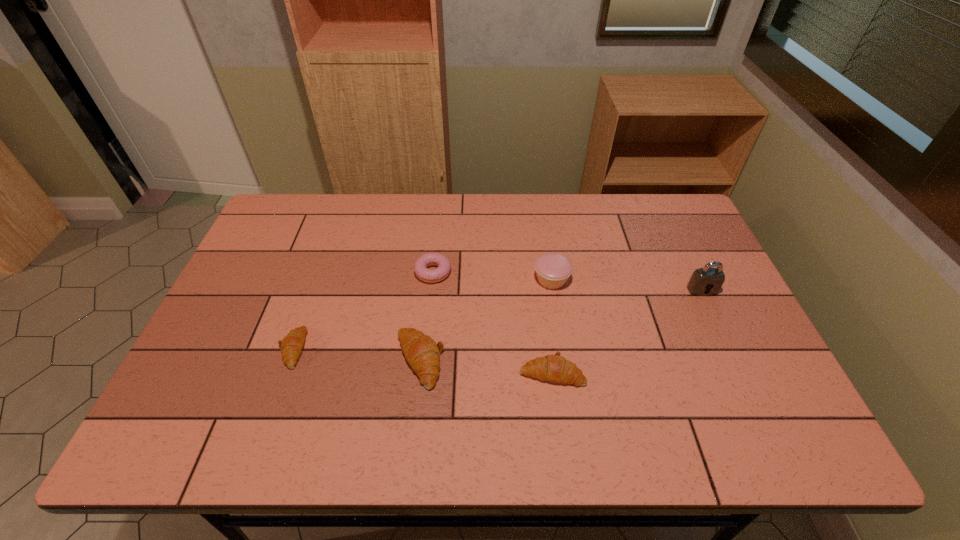
Find the location of a particular element. This screenshot has height=540, width=960. free point at the near left corner is located at coordinates (252, 376).

This screenshot has width=960, height=540. In order to click on free space at the far right corner in this screenshot , I will do `click(645, 216)`.

Locate an element on the screen. This screenshot has width=960, height=540. free space that is in between the second tallest object and the second crescent roll from left to right is located at coordinates (486, 320).

Where is `vacant region between the leftmost crescent roll and the cupcake`? The height and width of the screenshot is (540, 960). vacant region between the leftmost crescent roll and the cupcake is located at coordinates (422, 314).

Identify the location of free space that is in between the second tallest object and the shortest crescent roll. (422, 314).

Identify the location of unoccupied position between the second crescent roll from left to right and the doughnut. (426, 316).

Identify the location of free space between the doughnut and the second crescent roll from left to right. The width and height of the screenshot is (960, 540). (426, 316).

This screenshot has height=540, width=960. Find the location of `vacant area that lies between the tallest crescent roll and the leftmost crescent roll`. vacant area that lies between the tallest crescent roll and the leftmost crescent roll is located at coordinates (356, 354).

Where is `free space between the second shortest crescent roll and the second tallest object`? This screenshot has height=540, width=960. free space between the second shortest crescent roll and the second tallest object is located at coordinates (552, 326).

Locate an element on the screen. This screenshot has height=540, width=960. unoccupied area between the tallest crescent roll and the doughnut is located at coordinates (426, 316).